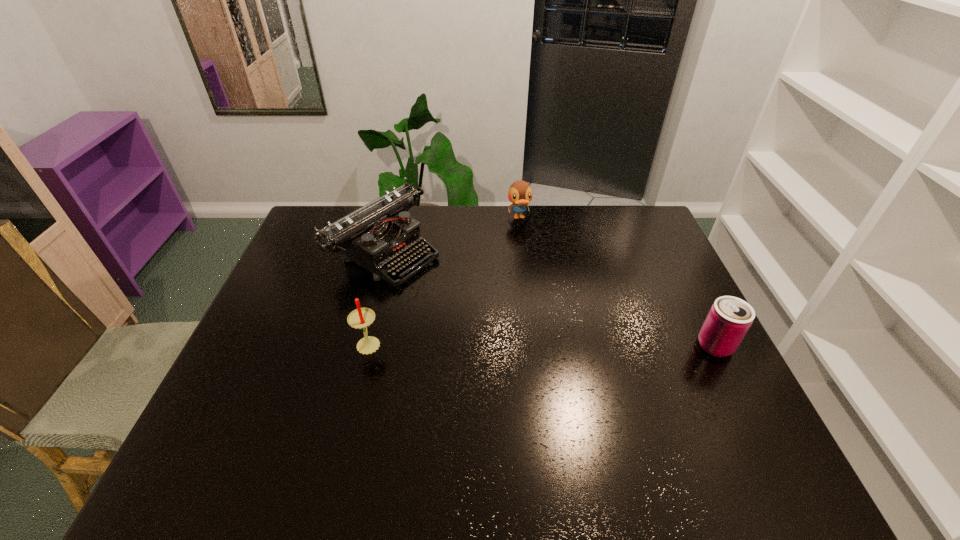
This screenshot has width=960, height=540. I want to click on free location at the near left corner, so click(269, 419).

Identify the location of vacant space that's between the typewriter and the can. This screenshot has width=960, height=540. (550, 299).

Find the location of `vacant region between the can and the third object from left to right`. vacant region between the can and the third object from left to right is located at coordinates (617, 281).

I want to click on empty space between the third object from left to right and the candle, so click(x=444, y=280).

At what (x,y) coordinates should I click in order to perform the action: click on vacant area that lies between the rightmost object and the candle. Please return your answer as a coordinate pair (x, y). Looking at the image, I should click on (542, 344).

Locate an element on the screen. vacant area that lies between the rightmost object and the typewriter is located at coordinates (550, 299).

At what (x,y) coordinates should I click in order to perform the action: click on empty space between the candle and the can. Please return your answer as a coordinate pair (x, y). Looking at the image, I should click on (542, 344).

Find the location of `free area in between the duck and the candle`. free area in between the duck and the candle is located at coordinates (444, 280).

Identify the location of vacant region between the typewriter and the can. (550, 299).

You are a GUI agent. You are given a task and a screenshot of the screen. Output one action in this format:
    pyautogui.click(x=<x>, y=<y>)
    Task: Click on the vacant area between the typewriter and the candle
    
    Given the screenshot: What is the action you would take?
    pyautogui.click(x=376, y=297)